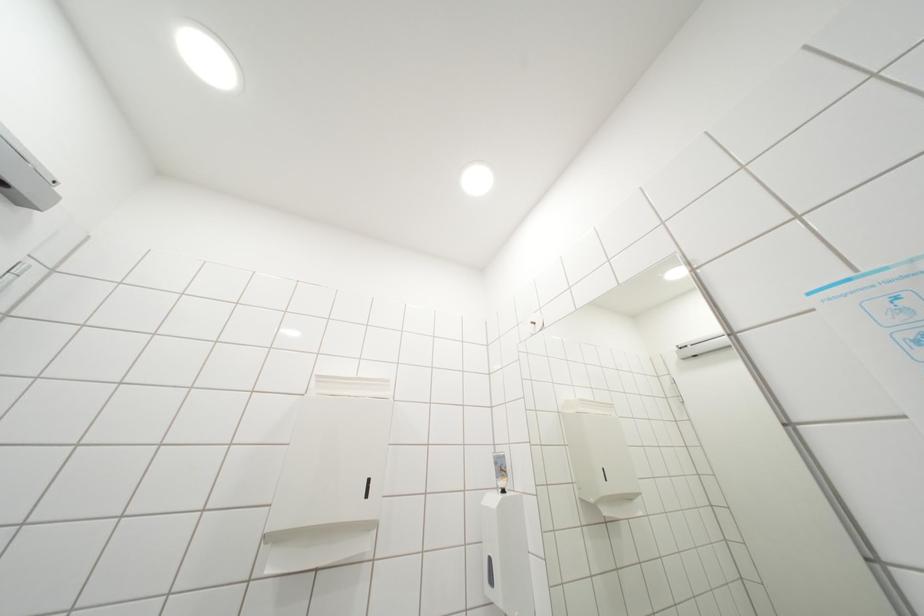
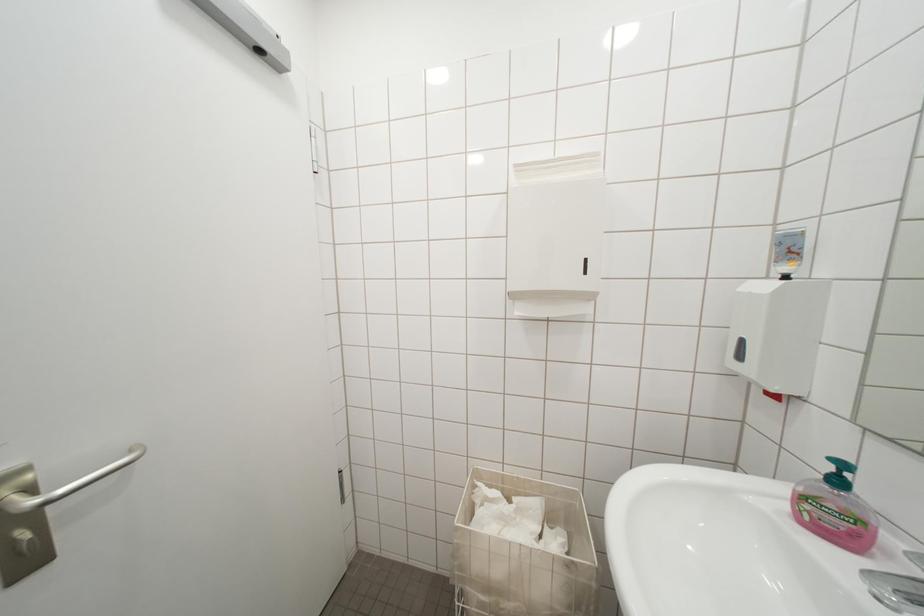
First-person continuous shooting, in which direction is the camera rotating?

The camera rotated toward left-down.